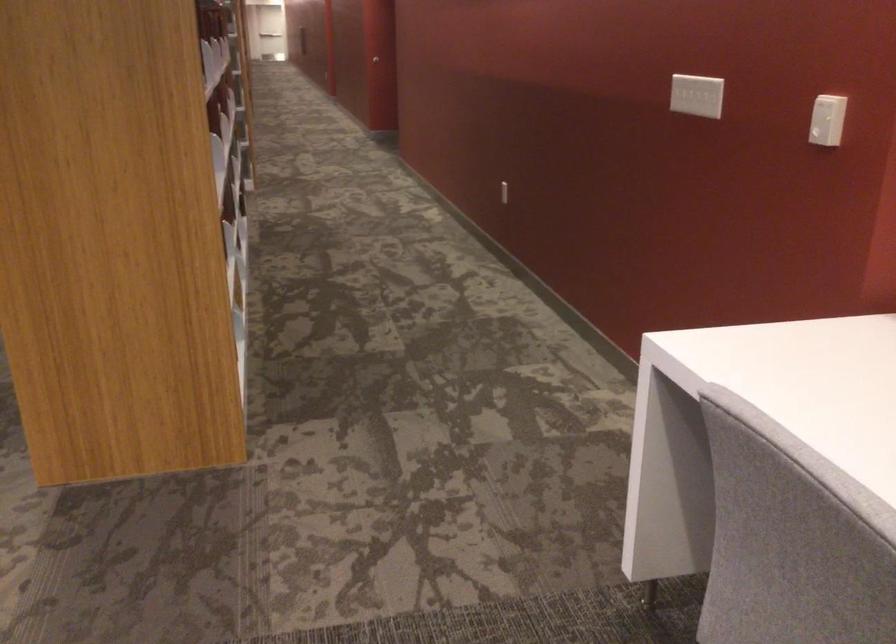
The images are taken continuously from a first-person perspective. In which direction is your viewpoint rotating?

The rotation direction of the camera is left-down.